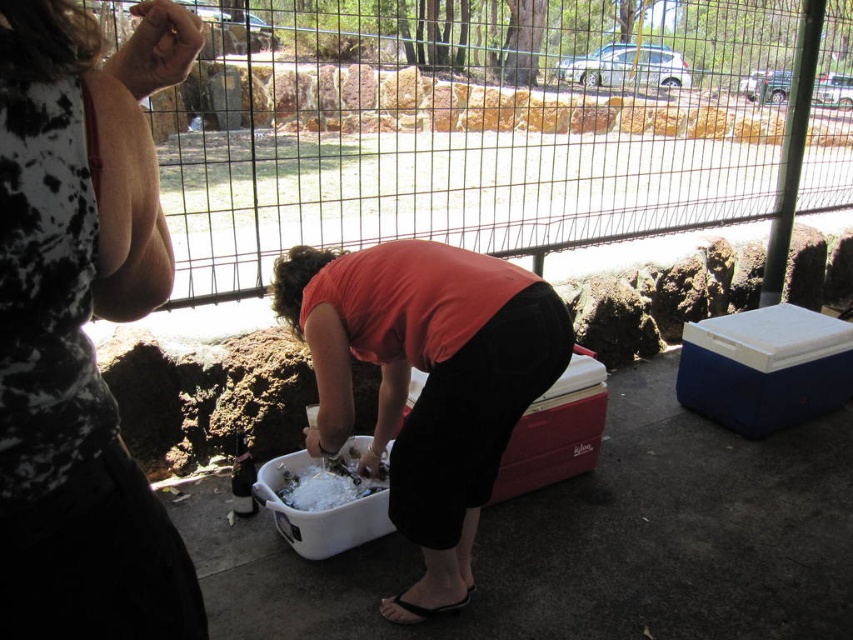
Is white plastic bucket at center taller than white plastic bucket at lower center?

Correct, white plastic bucket at center is much taller as white plastic bucket at lower center.

The height and width of the screenshot is (640, 853). In order to click on white plastic bucket at center in this screenshot , I will do `click(426, 381)`.

The height and width of the screenshot is (640, 853). What are the coordinates of `white plastic bucket at center` in the screenshot? It's located at (426, 381).

Between matte black shirt at center and white plastic bucket at lower center, which one has more height?

matte black shirt at center is taller.

Is point (178, 33) farther from viewer compared to point (323, 472)?

No.

Is point (96, 547) positioned before point (322, 486)?

Yes, point (96, 547) is closer to viewer.

Find the location of a particular element. matte black shirt at center is located at coordinates (80, 324).

From the picture: Which of these two, metal mesh fence at upper center or white plastic bucket at lower center, stands shorter?

white plastic bucket at lower center

From the picture: Which of these two, metal mesh fence at upper center or white plastic bucket at lower center, stands taller?

Standing taller between the two is metal mesh fence at upper center.

Is point (596, 106) farther from viewer compared to point (322, 467)?

That is True.

This screenshot has width=853, height=640. In order to click on metal mesh fence at upper center in this screenshot , I will do `click(461, 131)`.